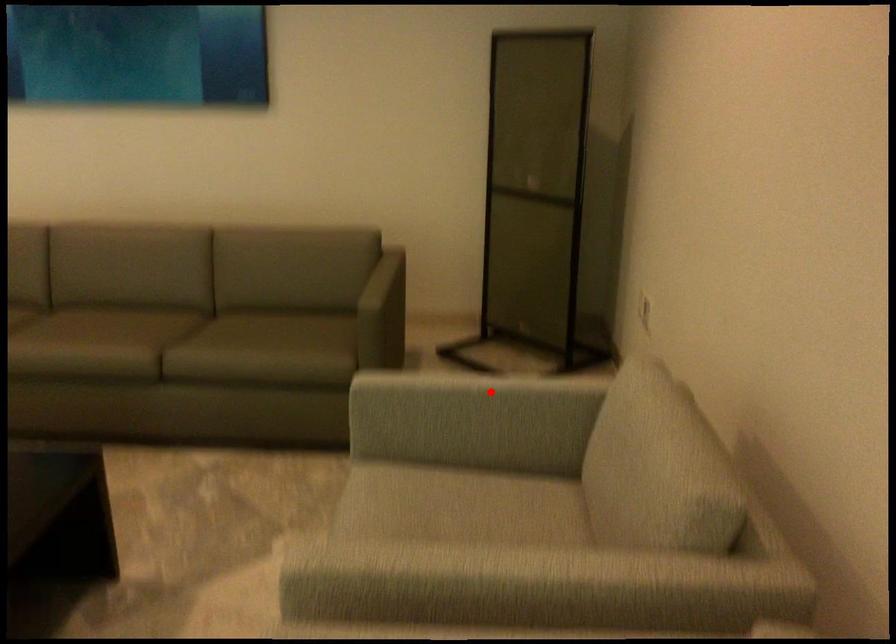
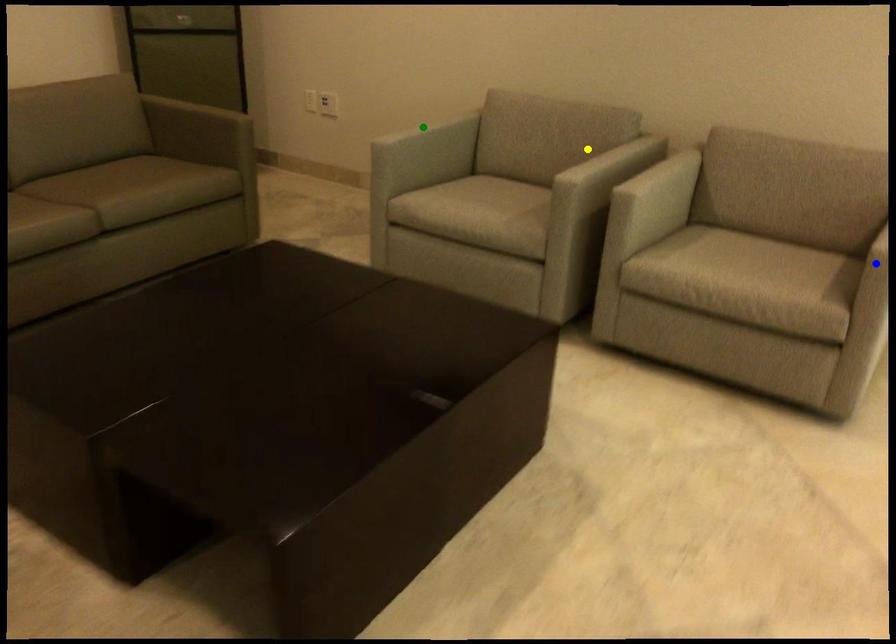
Question: I am providing you with two images of the same scene from different viewpoints. A red point is marked on the first image. You are given multiple points on the second image. Which point in image 2 represents the same 3d spot as the red point in image 1?

Choices:
 (A) yellow point
 (B) green point
 (C) blue point

Answer: (B)